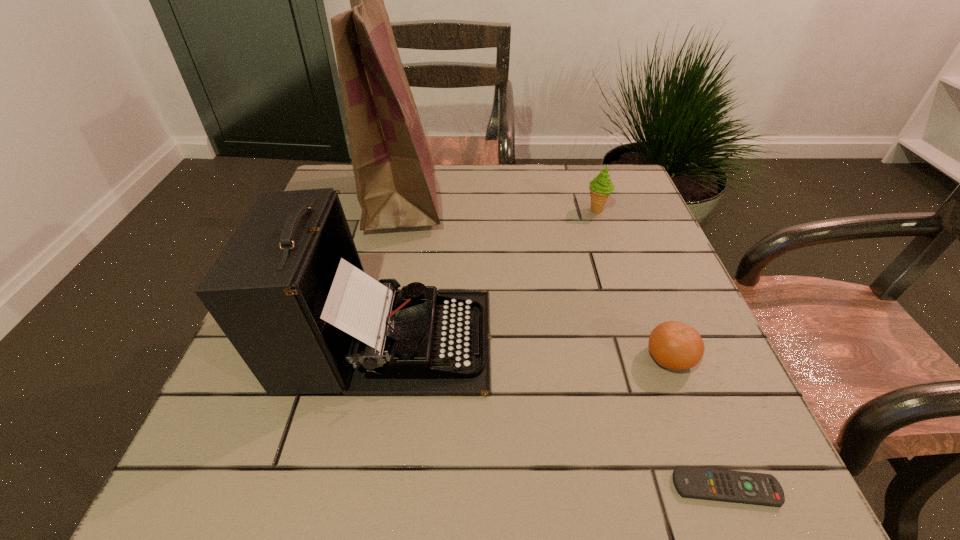
This screenshot has width=960, height=540. Identify the location of the tallest object. coord(394,173).

Identify the location of the second tallest object. (289, 291).

Identify the location of icecream. (601, 187).

The height and width of the screenshot is (540, 960). In order to click on clementine in this screenshot , I will do `click(674, 345)`.

Where is `the shortest object`? the shortest object is located at coordinates (690, 482).

At what (x,y) coordinates should I click in order to perform the action: click on the nearest object. Please return your answer as a coordinate pair (x, y). Looking at the image, I should click on (690, 482).

Where is `blank space located on the front-facing side of the grocery bag`? This screenshot has width=960, height=540. blank space located on the front-facing side of the grocery bag is located at coordinates (463, 199).

You are a GUI agent. You are given a task and a screenshot of the screen. Output one action in this format:
    pyautogui.click(x=<x>, y=<y>)
    Task: Click on the free region located inside the open case of the second tallest object
    This screenshot has height=540, width=960.
    Given the screenshot: What is the action you would take?
    pyautogui.click(x=517, y=340)

The image size is (960, 540). I want to click on vacant space located 0.070m on the front of the icecream, so click(x=605, y=234).

What are the coordinates of `vacant region located on the left of the fourth tallest object` in the screenshot? It's located at (446, 358).